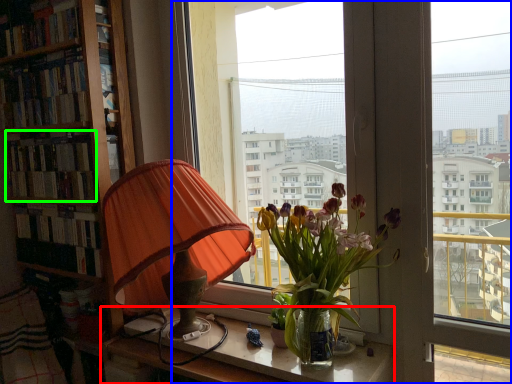
Question: Estimate the real-world distances between objects in this image. Which object is closer to table (highlighted by a red box), window (highlighted by a blue box) or book (highlighted by a green box)?

Choices:
 (A) window
 (B) book

Answer: (A)